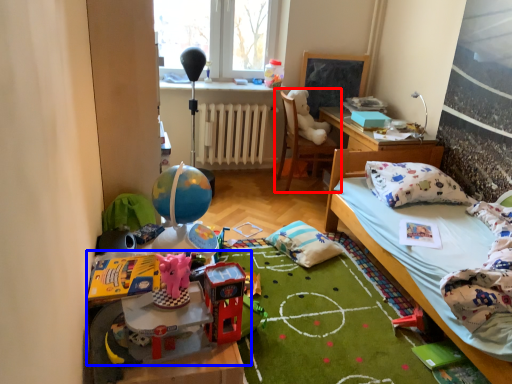
Question: Which of the following is the closest to the observer, chair (highlighted by a red box) or toy (highlighted by a blue box)?

Choices:
 (A) chair
 (B) toy

Answer: (B)